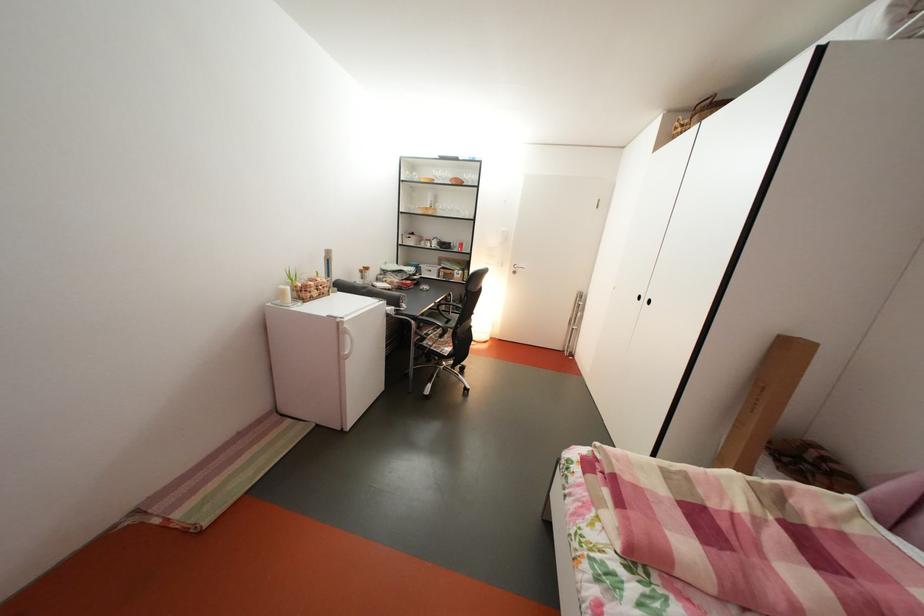
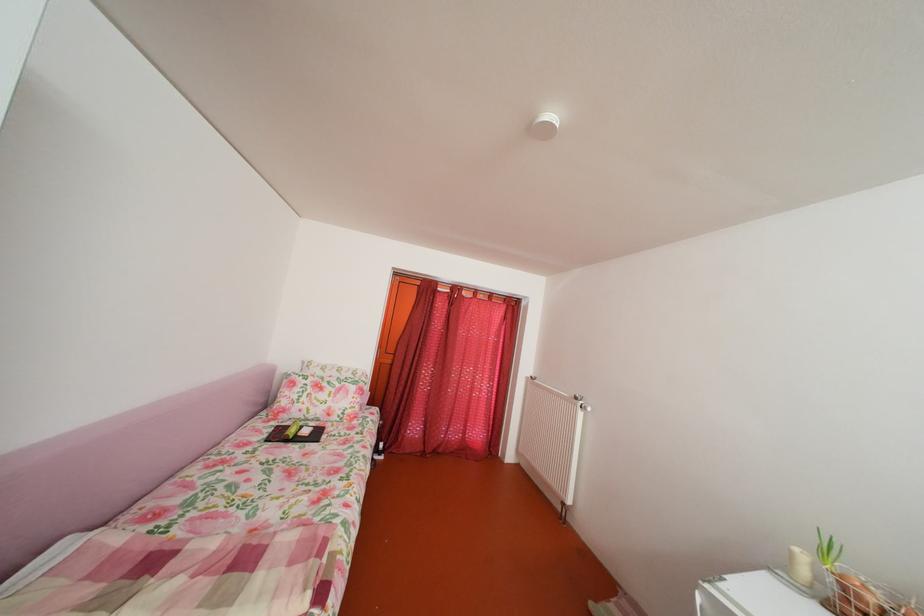
In the second image, find the point that corresponds to pixel 295 298 in the first image.

(803, 561)